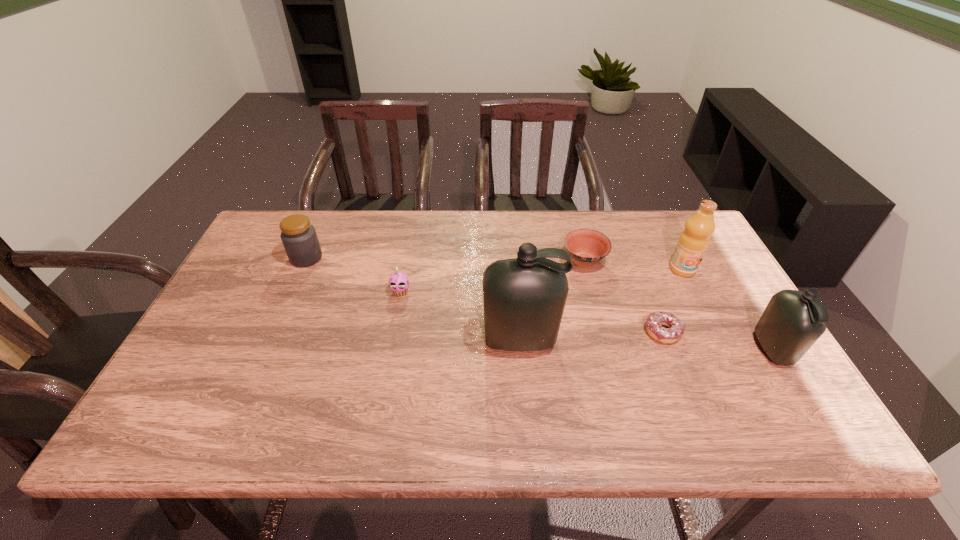
With all bottles evenly spaced, where should an extra bottle be placed on the left to continue the pattern? Please point out a vacant space. Please provide its 2D coordinates. Your answer should be formatted as a tuple, i.e. [(x, y)], where the tuple contains the x and y coordinates of a point satisfying the conditions above.

[(276, 331)]